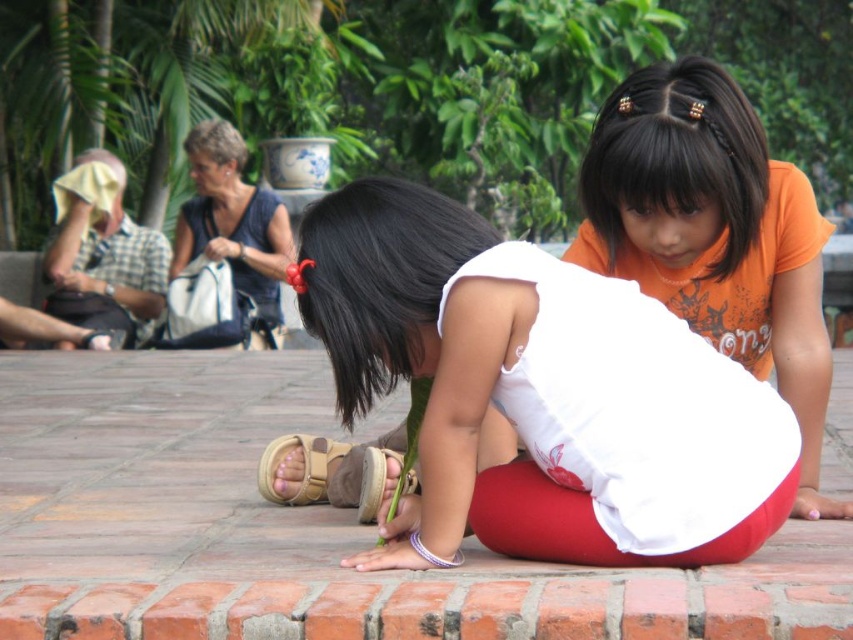
What is located at the coordinates point (677, 156) in the image?

The point (677, 156) indicates black silky hair at upper center.

You are a photographer trying to capture a closeup of the black silky hair at center and the blue fabric purse at upper left. Which object should you focus on first if you want to ensure both are in focus without moving the camera?

The black silky hair at center is closer to the viewer than the blue fabric purse at upper left. To ensure both are in focus, focus on the black silky hair at center first since it is closer, and the blue fabric purse at upper left will be in focus as it is further away.

You are a photographer trying to capture a candid shot of the orange cotton shirt at upper right and the tan suede sandal at lower center. Since you want both items to be in focus, which one should you adjust your camera focus on first?

The orange cotton shirt at upper right is closer to the viewer than the tan suede sandal at lower center. To ensure both are in focus, you should focus on the orange cotton shirt at upper right first because it is closer, and depth of field typically extends further behind the point of focus than in front.